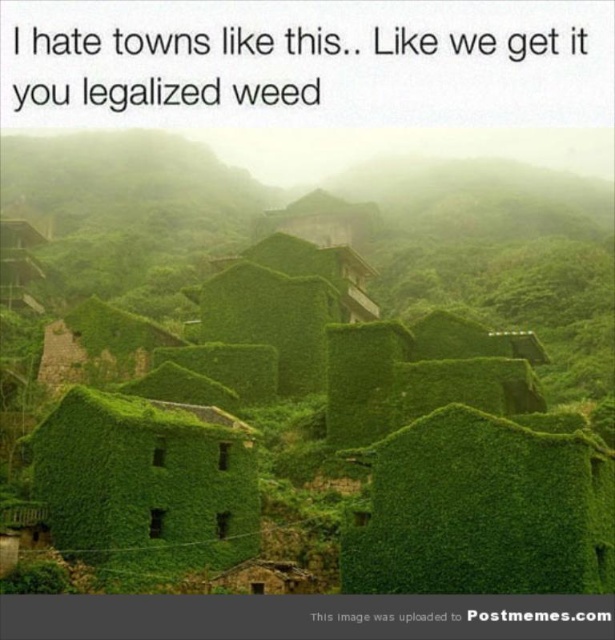
Between green moss-covered buildings at center and green ivy-covered hut at center, which one appears on the right side from the viewer's perspective?

green moss-covered buildings at center

Is green moss-covered buildings at center bigger than green ivy-covered hut at center?

Yes, green moss-covered buildings at center is bigger than green ivy-covered hut at center.

Where is `green moss-covered buildings at center`? Image resolution: width=615 pixels, height=640 pixels. green moss-covered buildings at center is located at coordinates (359, 346).